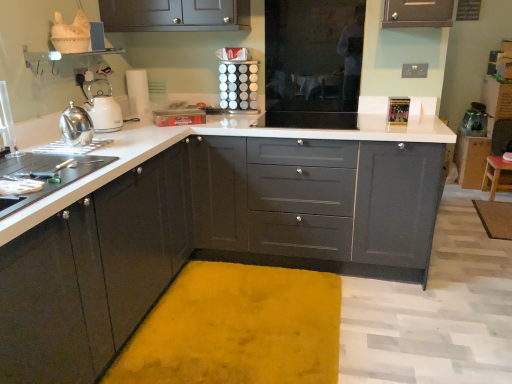
You are a GUI agent. You are given a task and a screenshot of the screen. Output one action in this format:
    pyautogui.click(x=<x>, y=<y>)
    Task: Click on the vacant space positioned to the left of yellow plush bath mat at lower right, the 2th bath mat viewed from the left
    
    Given the screenshot: What is the action you would take?
    pyautogui.click(x=464, y=222)